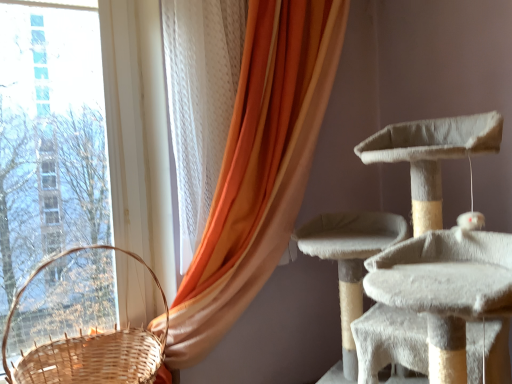
Question: From a real-world perspective, relative to orange fabric curtain at left, is woven wood basket at left vertically above or below?

Choices:
 (A) below
 (B) above

Answer: (A)

Question: Considering their positions, is woven wood basket at left located in front of or behind orange fabric curtain at left?

Choices:
 (A) front
 (B) behind

Answer: (A)

Question: From their relative heights in the image, would you say woven wood basket at left is taller or shorter than orange fabric curtain at left?

Choices:
 (A) tall
 (B) short

Answer: (B)

Question: Looking at the image, does orange fabric curtain at left seem bigger or smaller compared to woven wood basket at left?

Choices:
 (A) small
 (B) big

Answer: (B)

Question: Does point (264, 182) appear closer or farther from the camera than point (42, 264)?

Choices:
 (A) farther
 (B) closer

Answer: (B)

Question: Is orange fabric curtain at left to the left or to the right of woven wood basket at left in the image?

Choices:
 (A) right
 (B) left

Answer: (A)

Question: Is orange fabric curtain at left spatially inside woven wood basket at left, or outside of it?

Choices:
 (A) inside
 (B) outside

Answer: (B)